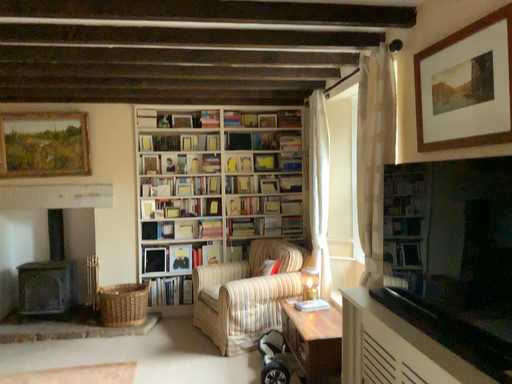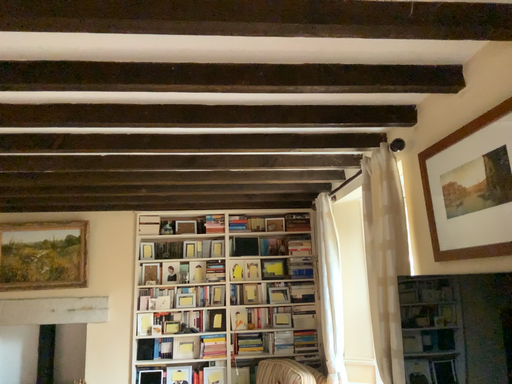
Question: How did the camera likely rotate when shooting the video?

Choices:
 (A) rotated downward
 (B) rotated upward

Answer: (B)